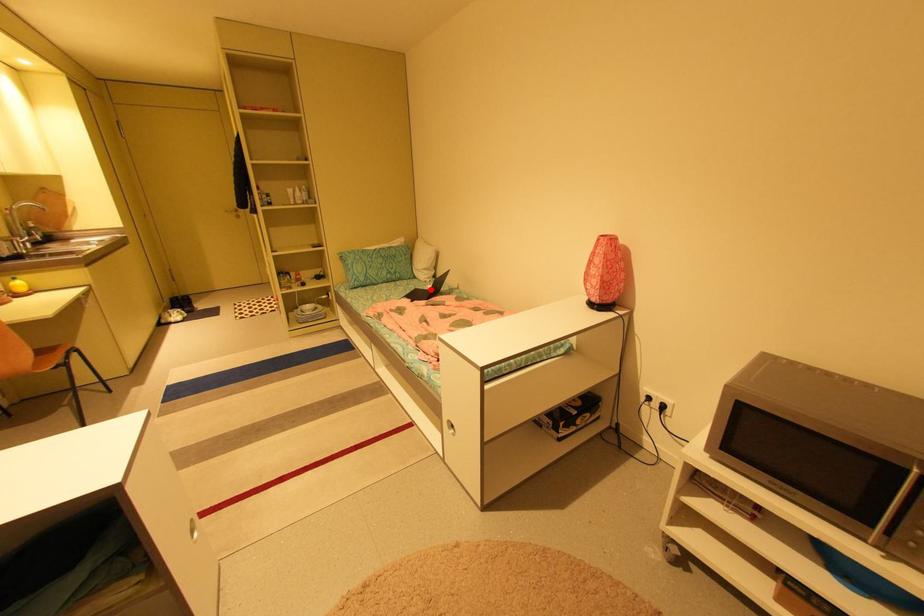
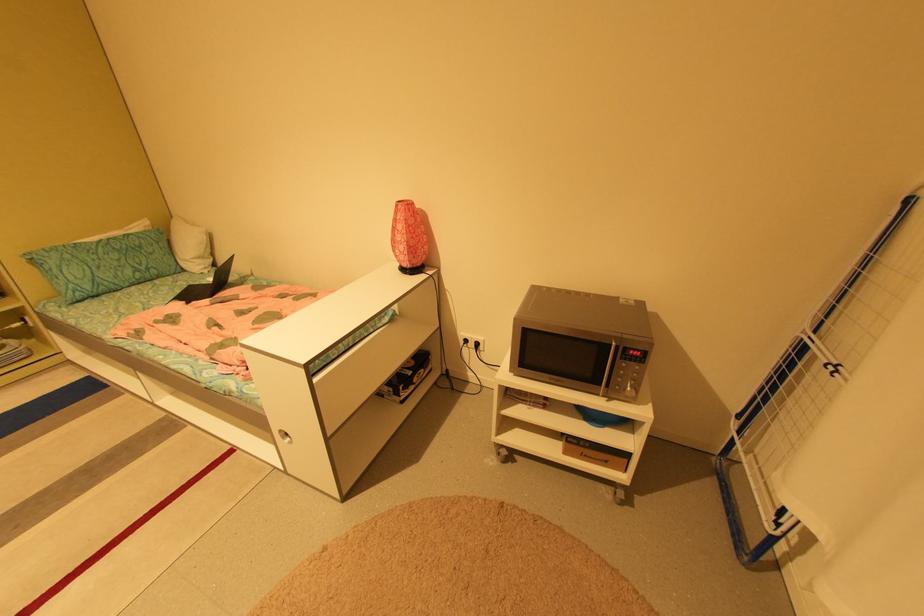
The point at the highlighted location is marked in the first image. Where is the corresponding point in the second image?

(210, 284)